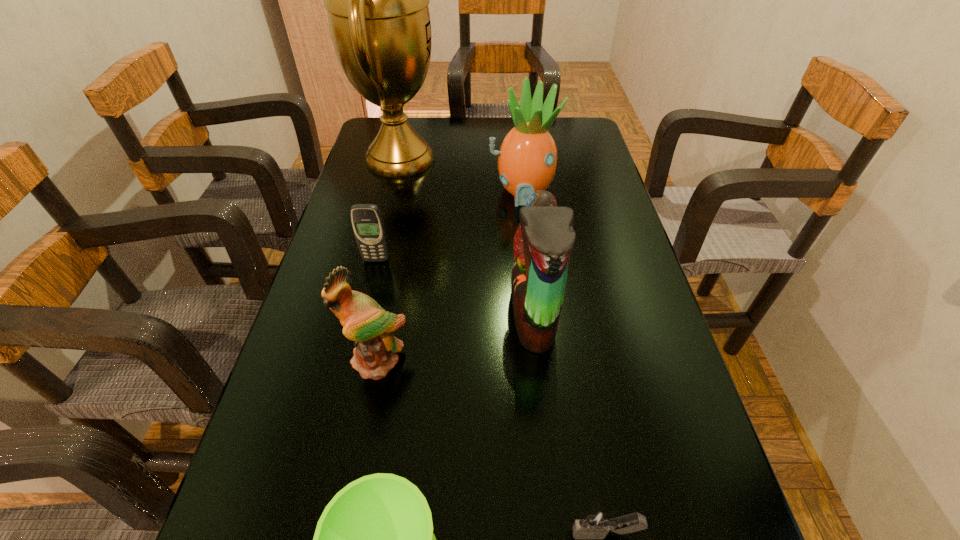
Where is `trophy cup`? The width and height of the screenshot is (960, 540). trophy cup is located at coordinates (377, 0).

Identify the location of pineapple. (527, 159).

Identify the location of the right parrot. click(542, 245).

Locate an element on the screen. This screenshot has height=540, width=960. the left parrot is located at coordinates (x=365, y=322).

I want to click on cellular telephone, so click(x=366, y=219).

Locate an element on the screen. vacant area located on the surface of the trophy cup with symbols is located at coordinates (497, 159).

This screenshot has width=960, height=540. Identify the location of free space located 0.090m at the entrance of the pineapple. (526, 231).

Identify the location of vacant area located 0.180m at the face of the right parrot. This screenshot has height=540, width=960. (428, 315).

Find the location of a particular element. The width and height of the screenshot is (960, 540). free space located at the face of the right parrot is located at coordinates 392,315.

This screenshot has height=540, width=960. I want to click on vacant region located 0.140m at the face of the right parrot, so click(x=446, y=315).